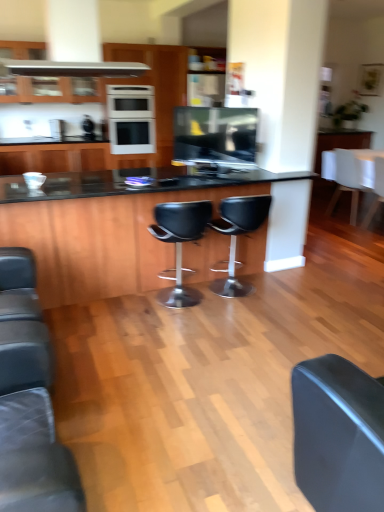
Locate an element on the screen. The width and height of the screenshot is (384, 512). free area below black leather stool at center, which ranks as the fourth chair in back-to-front order (from a real-world perspective) is located at coordinates 185,308.